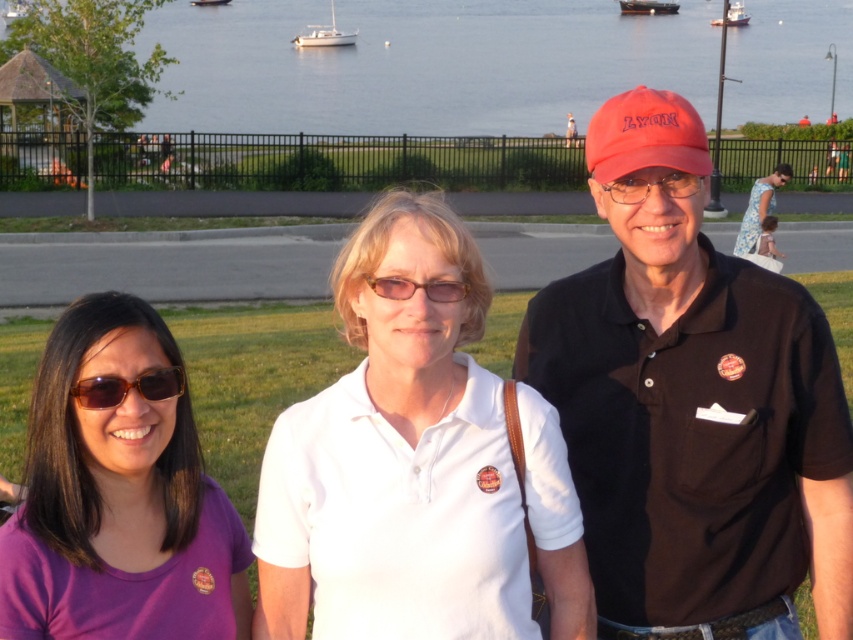
You are a photographer standing at the location of the translucent amber sunglasses at center. You want to take a photo of the white plastic boat at upper center. Considering the distance between them, do you think you can capture the boat clearly in your photo without zooming?

The distance between the translucent amber sunglasses at center and the white plastic boat at upper center is 159.74 meters. At this distance, capturing the boat clearly without zooming would be challenging as the boat would appear small in the frame.

You are planning to pack these items into a bag. The transparent plastic glasses at center and the white plastic boat at upper left need to be placed inside. Given their sizes, which item should you place first into the bag to ensure both fit properly?

Since the transparent plastic glasses at center is smaller than the white plastic boat at upper left, you should place the white plastic boat at upper left first, then the transparent plastic glasses at center on top to maximize space efficiency.